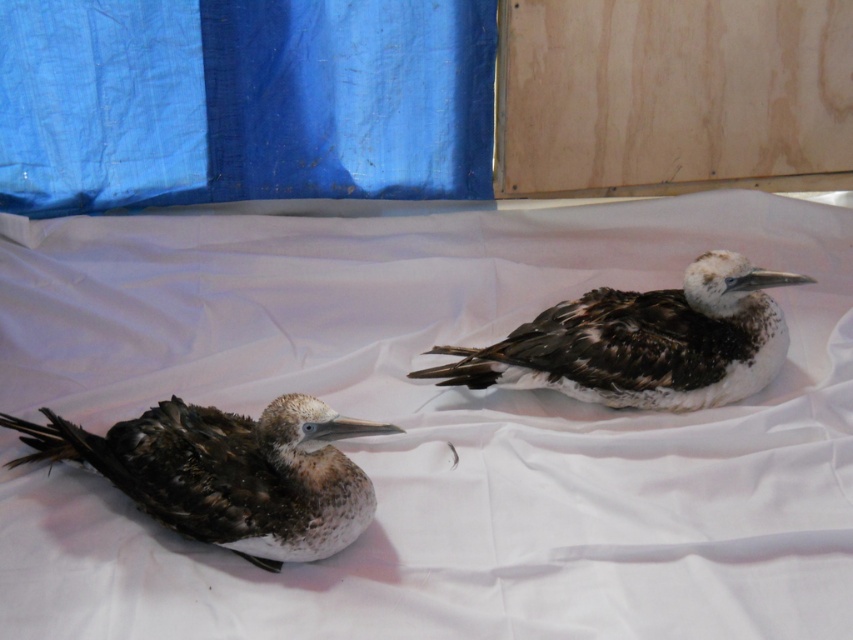
You are a wildlife rehabilitator assessing two birds in an enclosure. You need to determine which bird is smaller in height. The birds are the brown feathered bird at left and the brown speckled feathers at center. Can you identify the smaller one?

The brown feathered bird at left has a lesser height compared to brown speckled feathers at center, so the brown feathered bird at left is smaller in height.